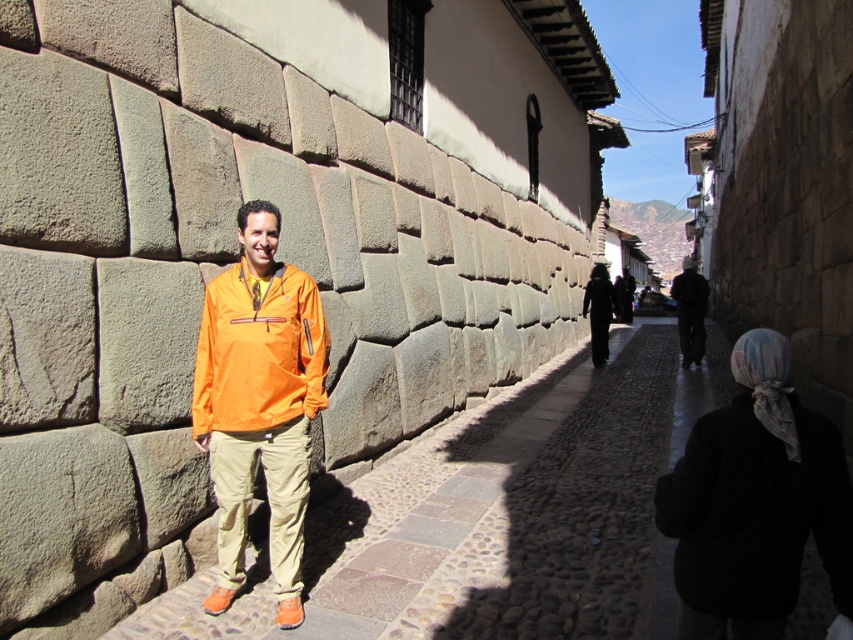
Can you confirm if black fabric headscarf at lower right is shorter than dark gray wool coat at center?

Indeed, black fabric headscarf at lower right has a lesser height compared to dark gray wool coat at center.

In the scene shown: Who is lower down, black fabric headscarf at lower right or dark gray wool coat at center?

Positioned lower is black fabric headscarf at lower right.

Does point (773, 404) come farther from viewer compared to point (699, 349)?

No, it is not.

Identify the location of black fabric headscarf at lower right. (755, 502).

Measure the distance between cobblestone pavement at center and camera.

cobblestone pavement at center and camera are 5.83 meters apart from each other.

Which is above, cobblestone pavement at center or matte orange jacket at center?

matte orange jacket at center is higher up.

Who is more forward, (x=202, y=612) or (x=299, y=598)?

Point (x=202, y=612) is in front.

Locate an element on the screen. This screenshot has height=640, width=853. cobblestone pavement at center is located at coordinates (494, 518).

Does matte orange jacket at center have a smaller size compared to dark gray wool coat at center?

Correct, matte orange jacket at center occupies less space than dark gray wool coat at center.

Does point (236, 547) lie behind point (694, 291)?

No.

Identify the location of matte orange jacket at center. The height and width of the screenshot is (640, 853). coord(259,403).